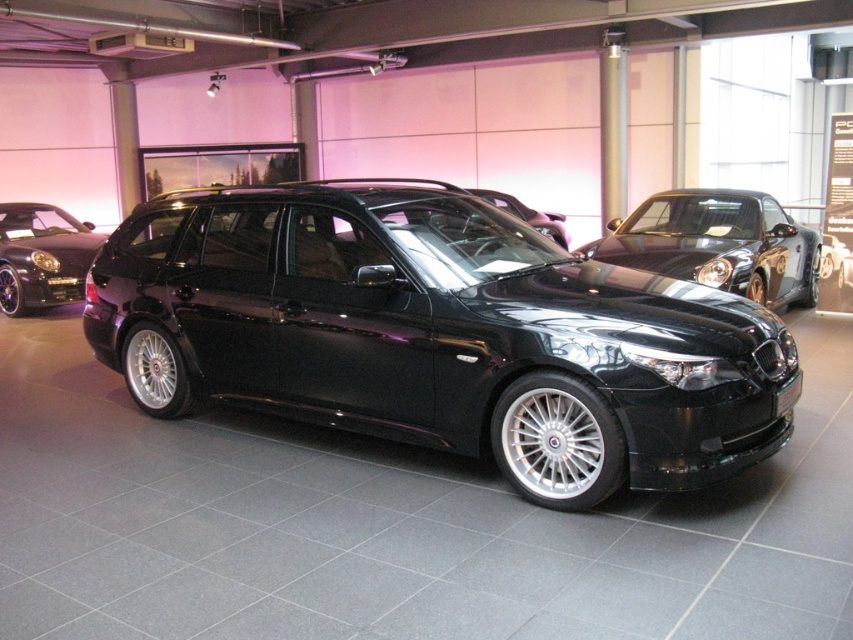
You are a photographer in a car showroom. You need to take a clear photo of the glossy black car at center without any obstruction from the glossy black car at left. Based on their positions, is this possible?

The glossy black car at center is in front of the glossy black car at left, so taking a clear photo of the glossy black car at center without obstruction is possible as it is positioned in front.

You are a photographer setting up a shoot in the showroom. You want to capture the glossy black wagon at center without the glossy black car at center appearing in the background. Based on their positions, is this possible?

The glossy black wagon at center is in front of the glossy black car at center, so yes, you can position the camera to focus on the wagon while the car is behind it and out of the frame.

You are a parking assistant robot that is 1.2 meters wide. You need to move from the glossy black wagon at center to the glossy black car at left. Is there enough space for you to maneuver between them?

The distance between the glossy black wagon at center and the glossy black car at left is 5.63 meters. Since the robot is 1.2 meters wide, there is sufficient space to maneuver between them as the distance is significantly larger than the robot.